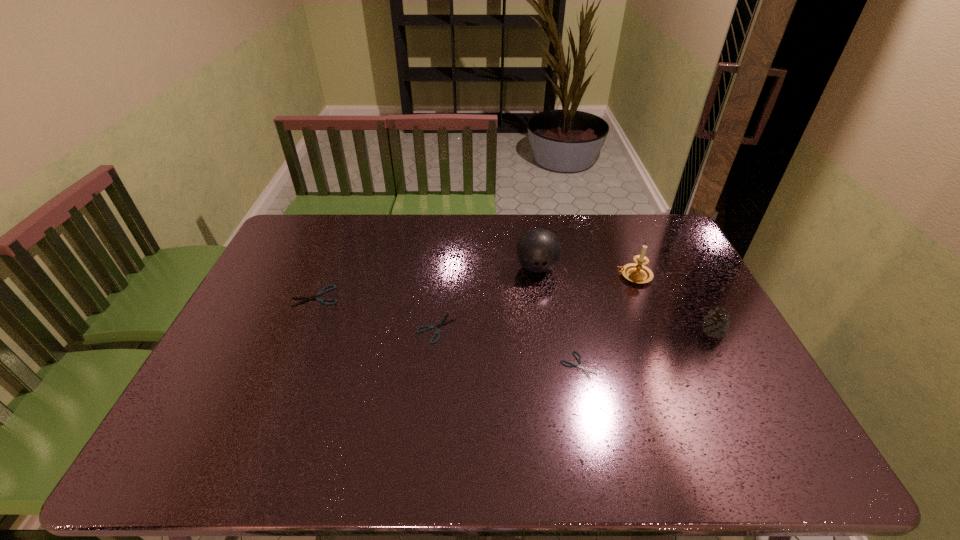
Find the location of `free space located 0.300m on the back of the farthest shears`. free space located 0.300m on the back of the farthest shears is located at coordinates (342, 232).

At what (x,y) coordinates should I click in order to perform the action: click on vacant space situated on the back of the second tallest shears. Please return your answer as a coordinate pair (x, y). The image size is (960, 540). Looking at the image, I should click on (440, 293).

This screenshot has width=960, height=540. Find the location of `free spot located on the left of the rightmost shears`. free spot located on the left of the rightmost shears is located at coordinates (x=536, y=366).

Identify the location of free spot located with a handle on the side of the candle holder. (566, 276).

This screenshot has height=540, width=960. What are the coordinates of `vacant area situated 0.400m with a handle on the side of the candle holder` in the screenshot? It's located at (494, 276).

Where is `free location located with a handle on the side of the candle holder`? Image resolution: width=960 pixels, height=540 pixels. free location located with a handle on the side of the candle holder is located at coordinates (530, 276).

Identify the location of free space located 0.070m on the grip area of the bowling ball. The width and height of the screenshot is (960, 540). pos(541,297).

You are a GUI agent. You are given a task and a screenshot of the screen. Output one action in this format:
    pyautogui.click(x=<x>, y=<y>)
    Task: Click on the free space located on the back of the rightmost object
    Image resolution: width=960 pixels, height=540 pixels.
    Given the screenshot: What is the action you would take?
    pyautogui.click(x=701, y=310)

At what (x,y) coordinates should I click in order to perform the action: click on object at the left edge. Please return your answer as a coordinate pair (x, y). The height and width of the screenshot is (540, 960). Looking at the image, I should click on (334, 286).

This screenshot has width=960, height=540. Find the location of `candle holder at the right edge`. candle holder at the right edge is located at coordinates (638, 273).